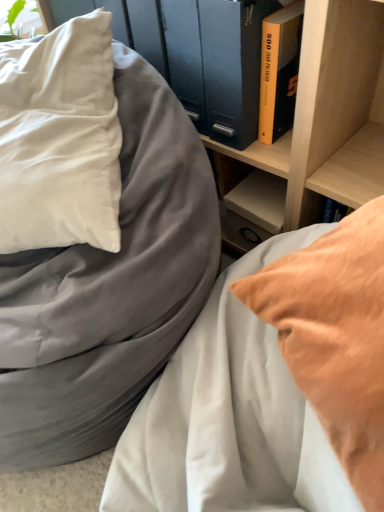
Question: Do you think white satin pillow at left is within matte gray bed at center, which is counted as the first bed, starting from the right, or outside of it?

Choices:
 (A) inside
 (B) outside

Answer: (B)

Question: Is white satin pillow at left wider or thinner than matte gray bed at center, which is counted as the first bed, starting from the right?

Choices:
 (A) thin
 (B) wide

Answer: (A)

Question: Which is nearer to the white satin pillow at left?

Choices:
 (A) matte gray bed at center, the 2th bed from the right
 (B) matte gray bed at center, acting as the second bed starting from the left
 (C) yellow hardcover book at upper right
 (D) wooden shelf at upper center
 (E) yellow matte book at upper right

Answer: (A)

Question: Based on their relative distances, which object is nearer to the wooden shelf at upper center?

Choices:
 (A) matte gray bed at center, which is the first bed in left-to-right order
 (B) matte gray bed at center, which is counted as the first bed, starting from the right
 (C) yellow matte book at upper right
 (D) white satin pillow at left
 (E) yellow hardcover book at upper right

Answer: (C)